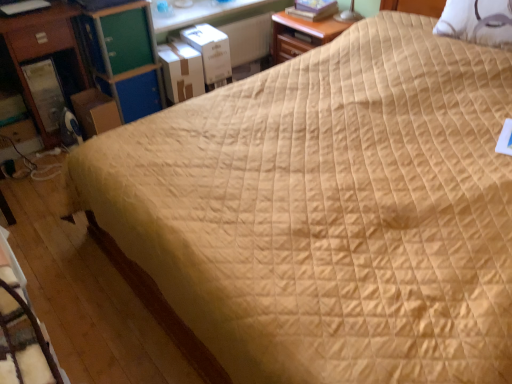
What are the coordinates of `vacant space situated above brown cardboard box at left, which is the first cardboard box in left-to-right order (from a real-world perspective)` in the screenshot? It's located at (96, 94).